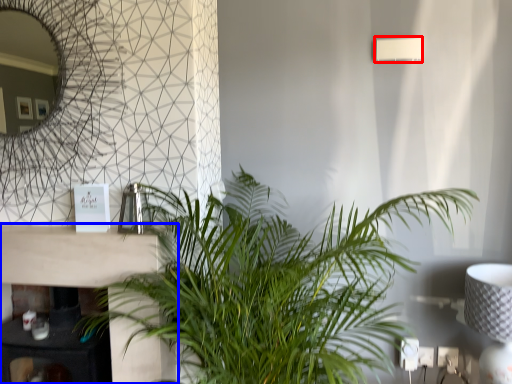
Question: Which of the following is the closest to the observer, lamp (highlighted by a red box) or table (highlighted by a blue box)?

Choices:
 (A) lamp
 (B) table

Answer: (B)